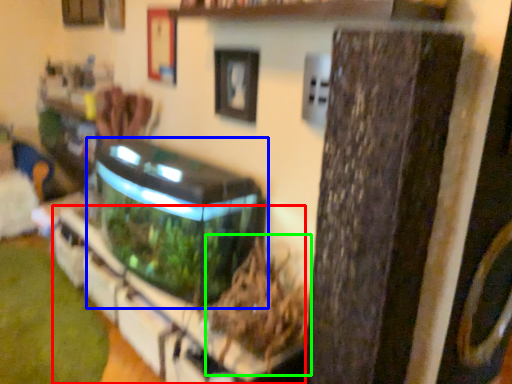
Question: Which is farther away from shelf (highlighted by a red box)? water tank (highlighted by a blue box) or plant (highlighted by a green box)?

Choices:
 (A) water tank
 (B) plant

Answer: (A)